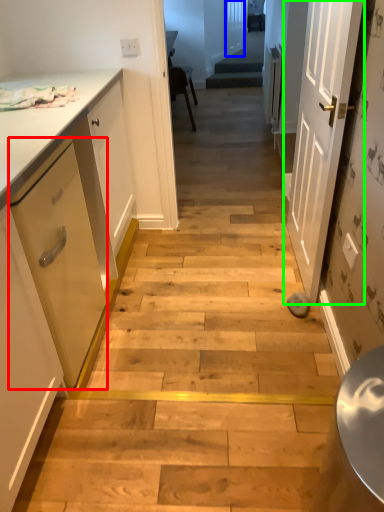
Question: Based on their relative distances, which object is farther from drawer (highlighted by a red box)? Choose from door (highlighted by a blue box) and door (highlighted by a green box).

Choices:
 (A) door
 (B) door

Answer: (A)